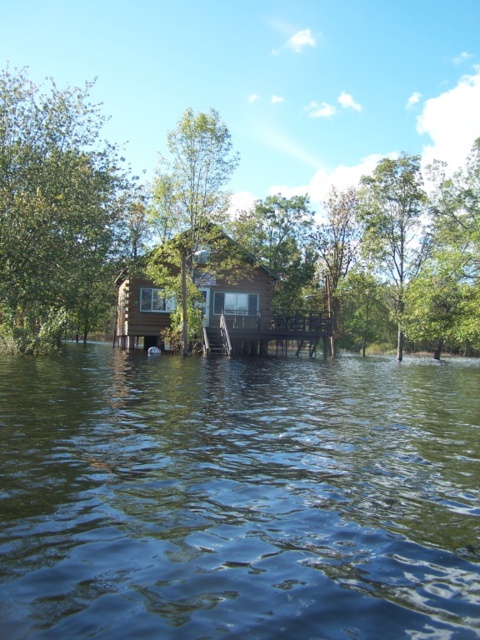
Consider the image. You are a photographer planning to capture the entire scene of the green water at center and the green matte tree at center in one shot. Based on their sizes in the image, which object should you focus on to ensure both are clearly visible?

The green water at center occupies less space than the green matte tree at center, so you should focus on the green matte tree at center to ensure both are clearly visible.

You are a bird flying over the flooded area and want to land on the tallest tree. Which tree should you choose between the green leafy tree at upper left and the green leafy tree at upper right?

The green leafy tree at upper left is bigger than the green leafy tree at upper right, so you should choose the green leafy tree at upper left to land on.

You are a boat operator navigating a narrow waterway. You see the green water at center and the green leafy tree at upper left in your path. Which object is wider from your perspective?

The green leafy tree at upper left is wider than the green water at center from your perspective.